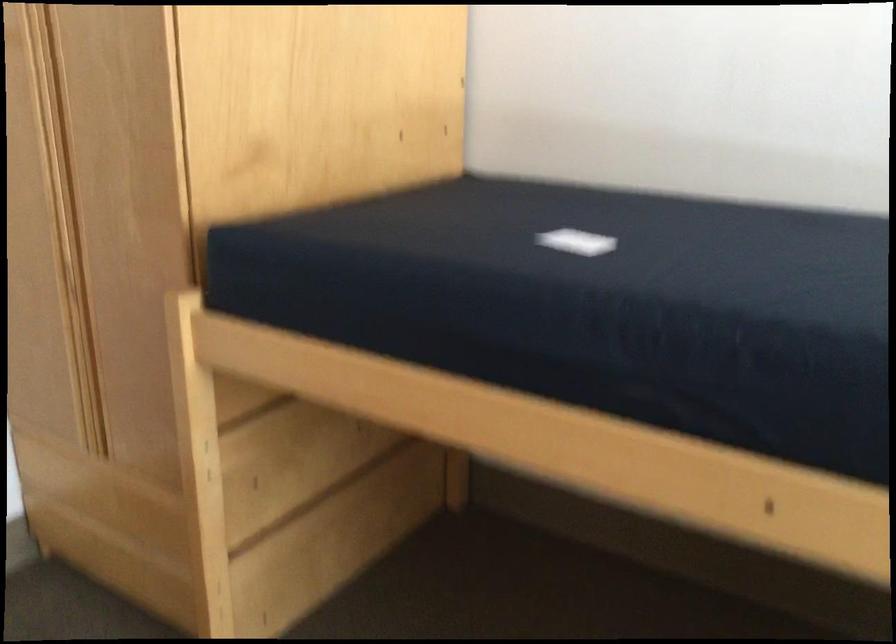
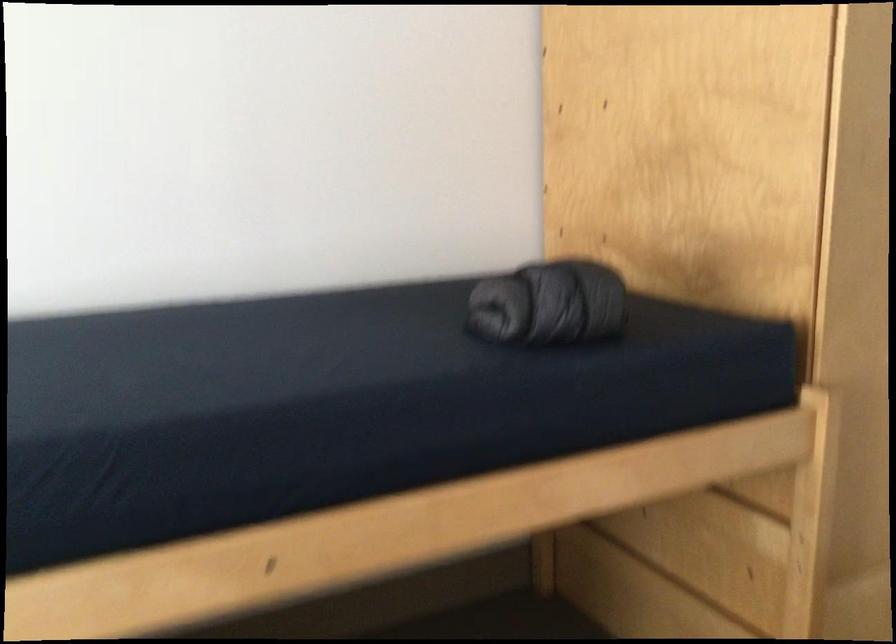
How did the camera likely rotate?

The camera's rotation is toward left-down.